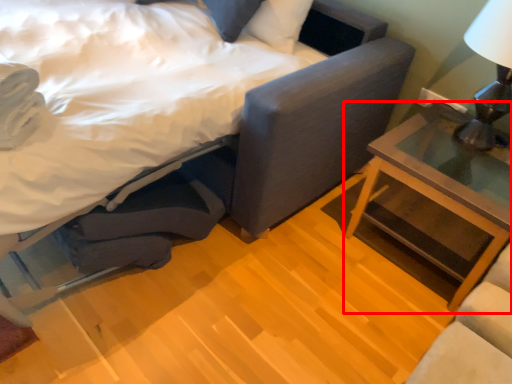
Question: Where is nightstand (annotated by the red box) located in relation to bed in the image?

Choices:
 (A) left
 (B) right

Answer: (B)